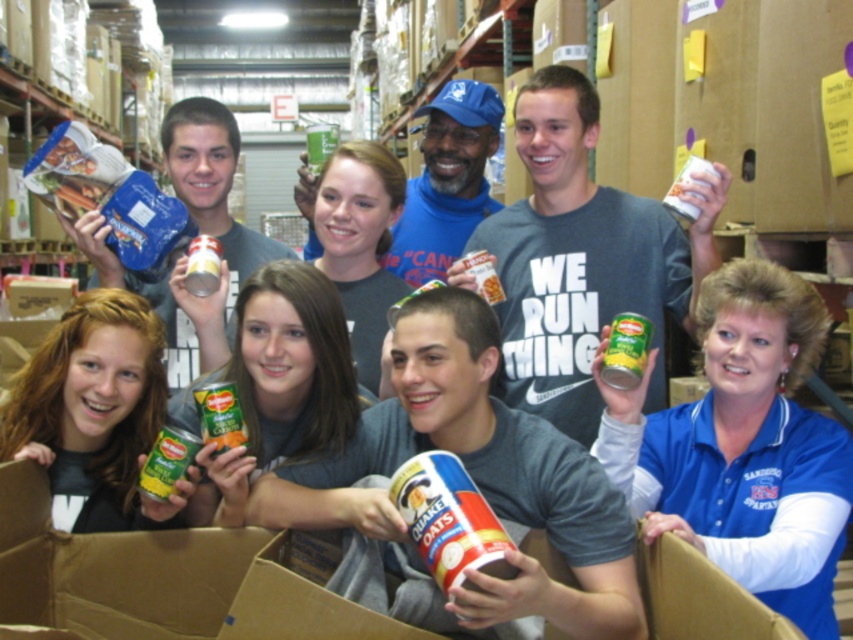
Question: Which point appears farthest from the camera in this image?

Choices:
 (A) (523, 301)
 (B) (113, 356)

Answer: (A)

Question: Is white paper cup at center wider than green matte can at lower left?

Choices:
 (A) no
 (B) yes

Answer: (B)

Question: Does blue fabric shirt at lower right appear over green metallic can at center?

Choices:
 (A) yes
 (B) no

Answer: (B)

Question: From the image, what is the correct spatial relationship of white paper cup at center in relation to green metallic can at center?

Choices:
 (A) below
 (B) above

Answer: (A)

Question: Estimate the real-world distances between objects in this image. Which object is farther from the green matte can at upper left?

Choices:
 (A) white paper cup at center
 (B) green matte can at lower left
 (C) blue fabric shirt at lower right
 (D) green metallic can at center

Answer: (C)

Question: Which of the following is the farthest from the observer?

Choices:
 (A) (177, 481)
 (B) (258, 518)
 (C) (642, 234)
 (D) (811, 428)

Answer: (C)